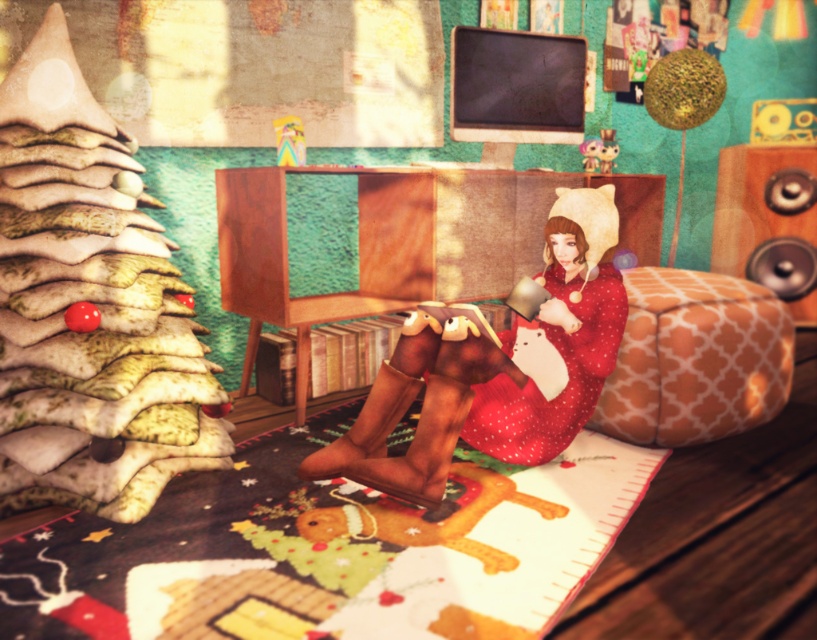
You are a fashion designer observing the festive scene. You notice two dresses at the center of the image. Can you determine if there is enough space between the matte red dress at center and the red dotted fabric dress at center to comfortably place a 3.5 inch wide accessory between them?

The distance between the matte red dress at center and the red dotted fabric dress at center is 2.75 inches, which is less than the 3.5 inch width of the accessory. Therefore, there isn not enough space to comfortably place the accessory between them.

You are organizing a Christmas party and need to place a 1.5 meter tall Christmas tree decoration next to the metallic silver speaker at right. Can the matte red dress at center fit between them without being squashed?

The matte red dress at center is taller than the metallic silver speaker at right, so it can fit between them without being squashed as long as there is enough horizontal space.